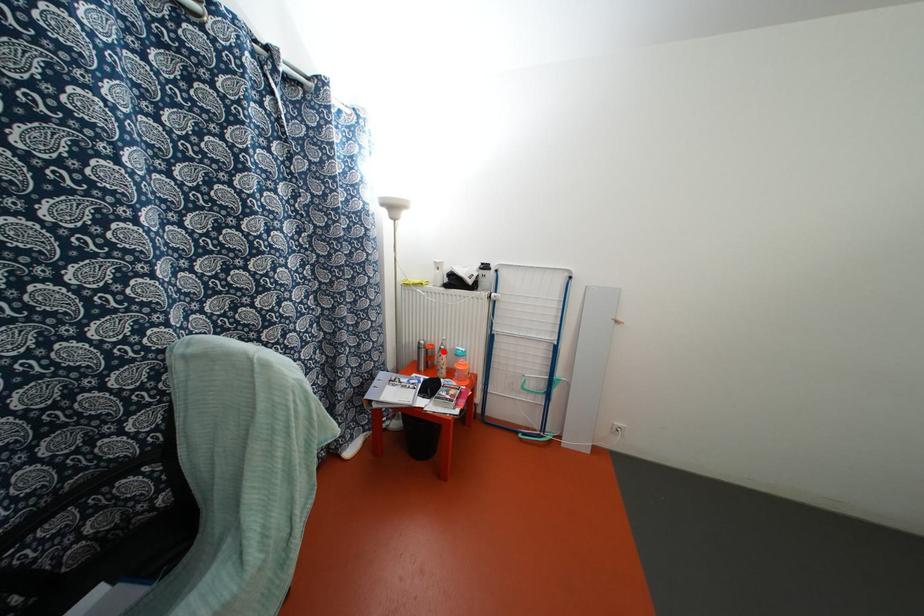
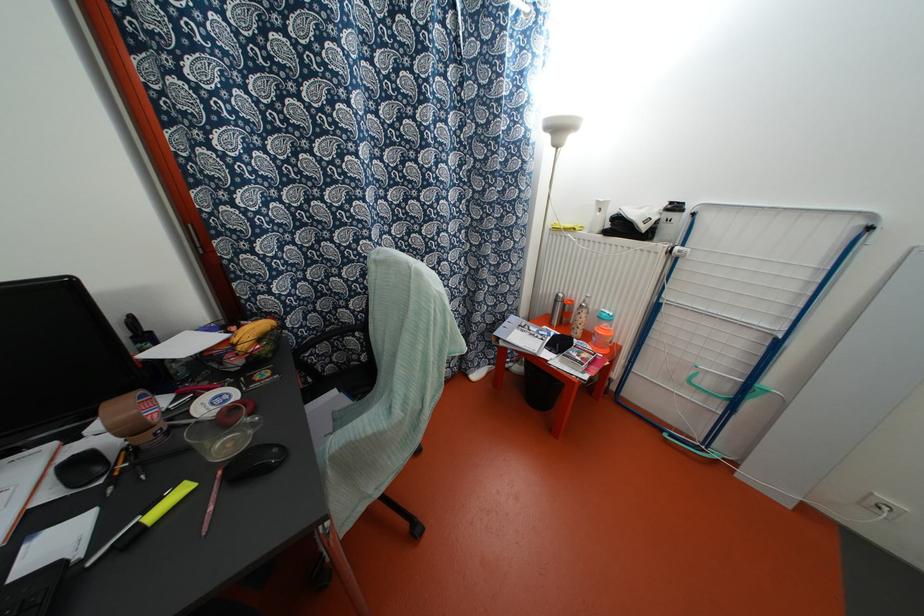
Find the pixel in the second image that matches the highlighted location in the first image.

(584, 310)